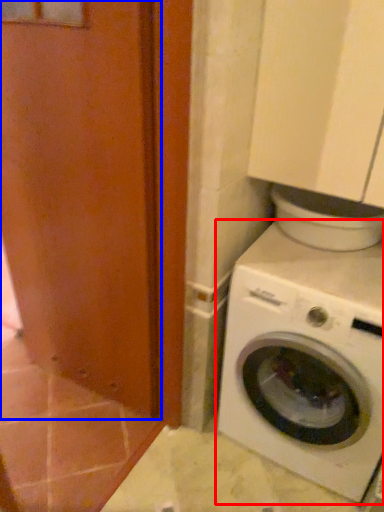
Question: Which object is closer to the camera taking this photo, washing machine (highlighted by a red box) or screen door (highlighted by a blue box)?

Choices:
 (A) washing machine
 (B) screen door

Answer: (B)